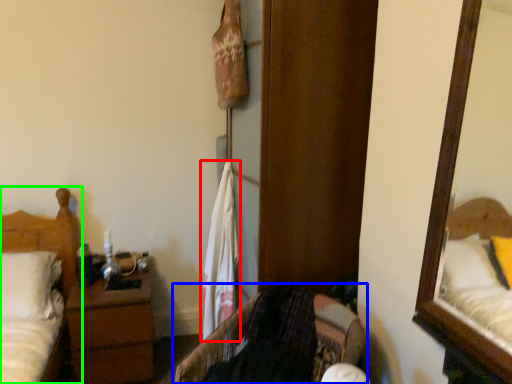
Question: Which is farther away from laundry (highlighted by a red box)? furniture (highlighted by a blue box) or bed (highlighted by a green box)?

Choices:
 (A) furniture
 (B) bed

Answer: (B)